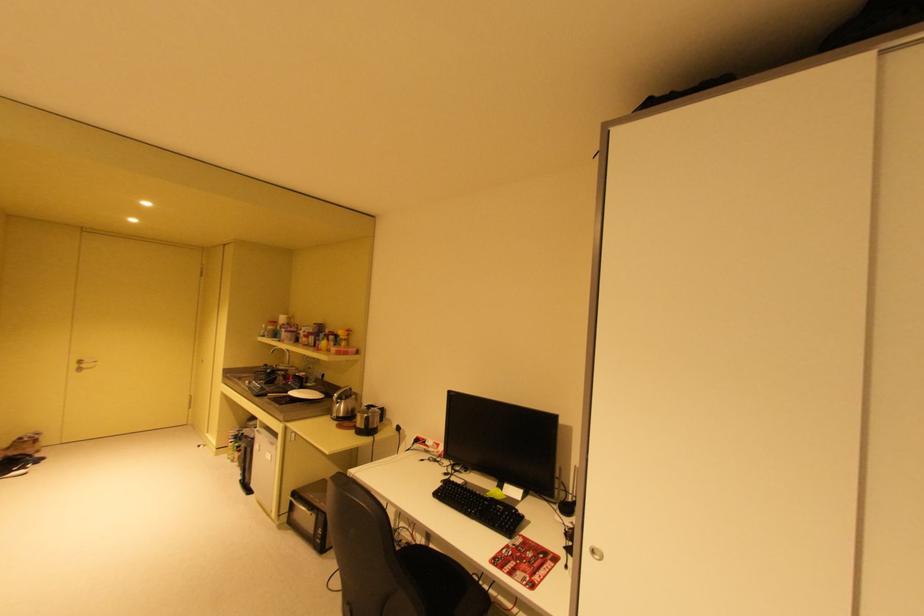
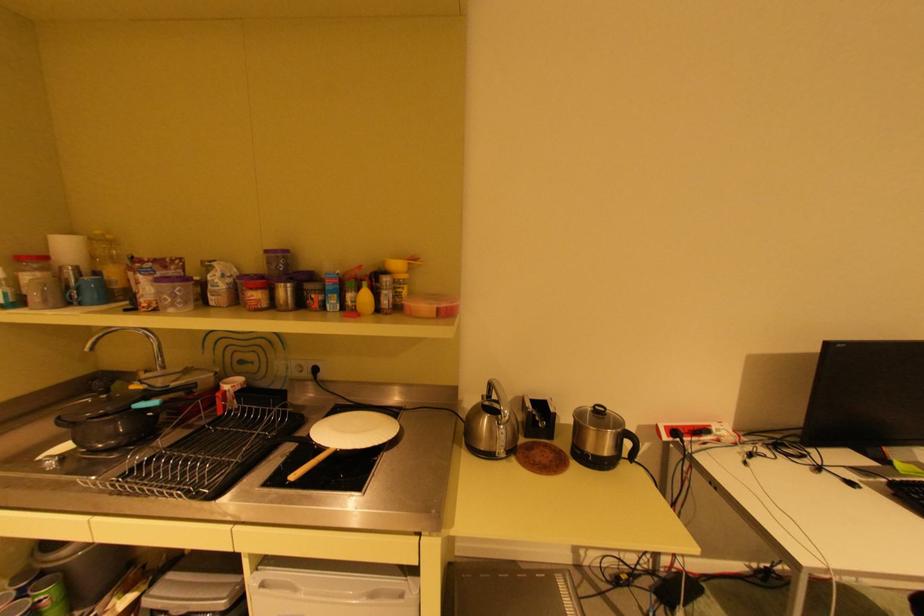
Where in the second image is the point corresponding to point (284, 338) from the first image?

(79, 302)